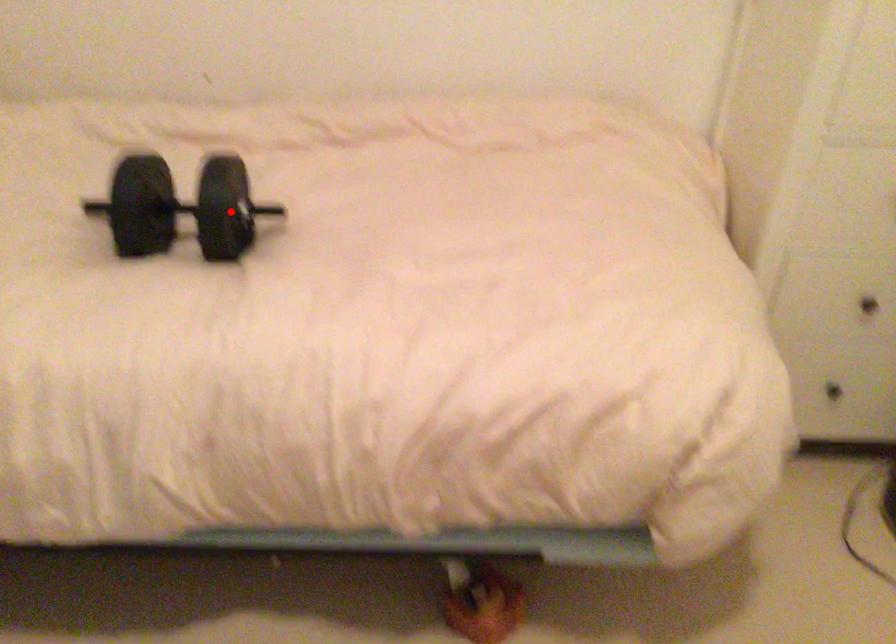
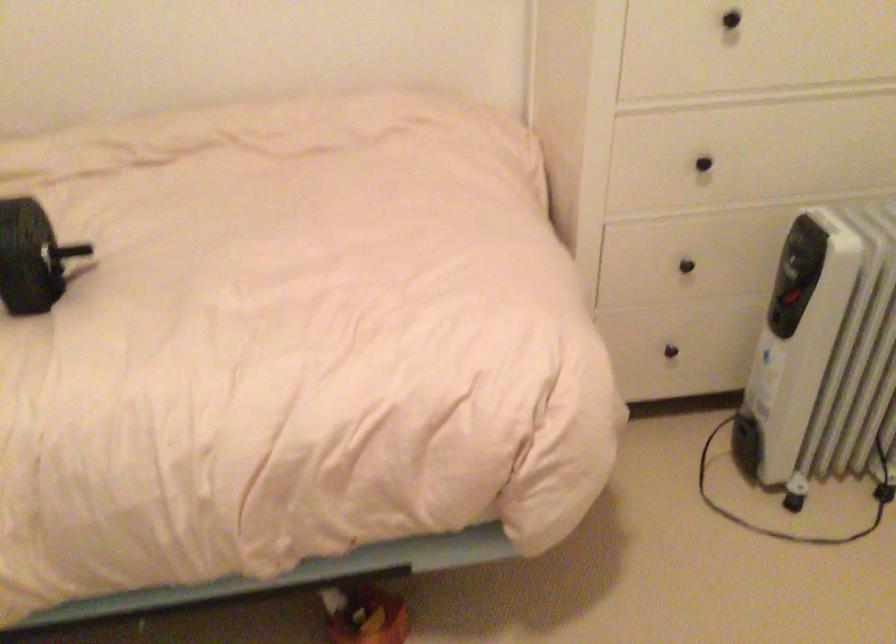
Find the pixel in the second image that matches the highlighted location in the first image.

(30, 257)